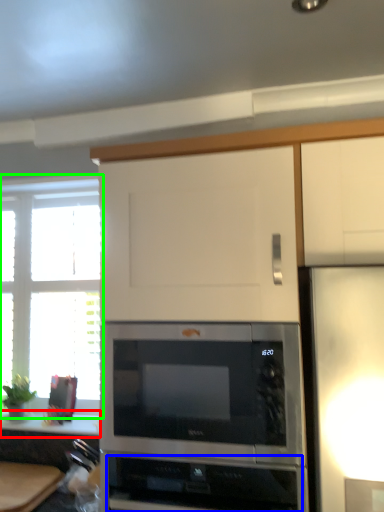
Question: Which is farther away from counter top (highlighted by a red box)? appliance (highlighted by a blue box) or window (highlighted by a green box)?

Choices:
 (A) appliance
 (B) window

Answer: (A)